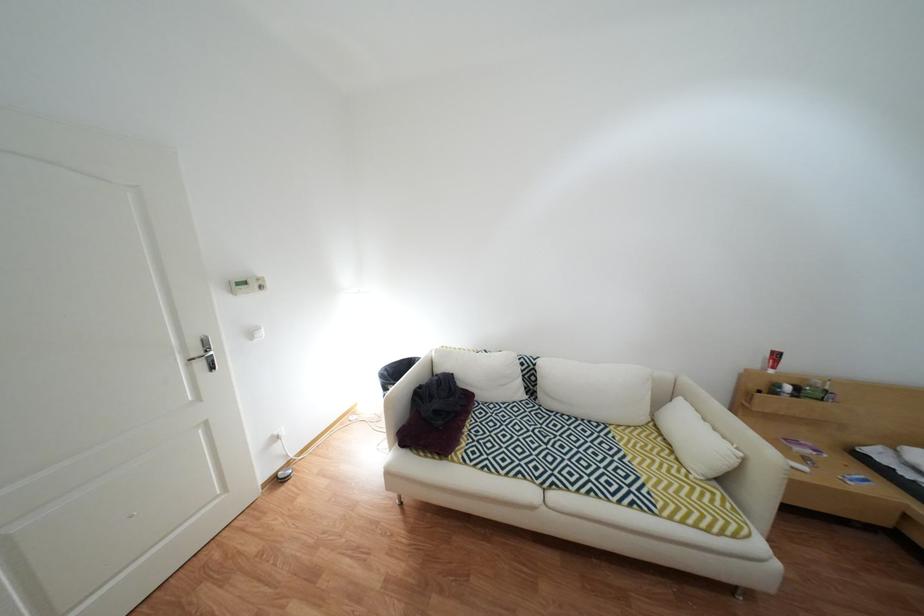
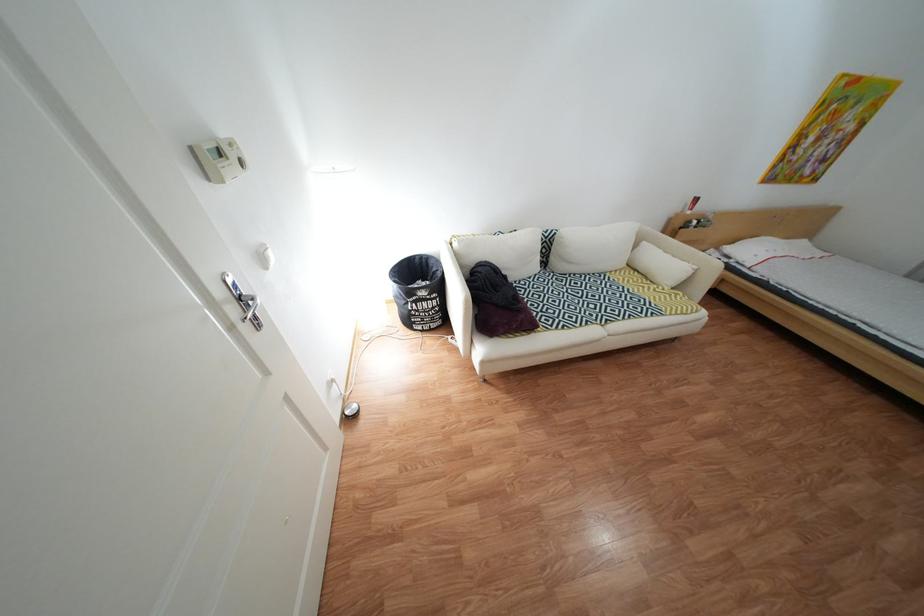
The point at (492,400) is marked in the first image. Where is the corresponding point in the second image?

(525, 281)